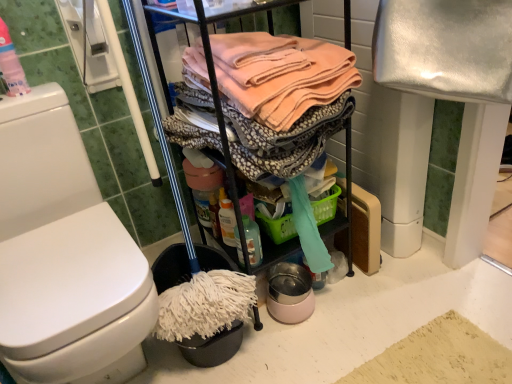
Question: Should I look upward or downward to see translucent plastic spray bottle at lower center, the 2th cleaning products in the left-to-right sequence?

Choices:
 (A) down
 (B) up

Answer: (A)

Question: Is translucent plastic bottle at upper left, which appears as the second cleaning products when viewed from the right, at the back of soft peach fabric at center?

Choices:
 (A) no
 (B) yes

Answer: (A)

Question: Is soft peach fabric at center not close to translucent plastic bottle at upper left, the first cleaning products from the left?

Choices:
 (A) yes
 (B) no

Answer: (B)

Question: Is soft peach fabric at center outside of translucent plastic bottle at upper left, the 1th cleaning products positioned from the top?

Choices:
 (A) no
 (B) yes

Answer: (B)

Question: Considering the relative sizes of soft peach fabric at center and translucent plastic bottle at upper left, which is the 2th cleaning products in bottom-to-top order, in the image provided, is soft peach fabric at center shorter than translucent plastic bottle at upper left, which is the 2th cleaning products in bottom-to-top order,?

Choices:
 (A) no
 (B) yes

Answer: (A)

Question: From a real-world perspective, is soft peach fabric at center physically above translucent plastic bottle at upper left, the 1th cleaning products positioned from the top?

Choices:
 (A) no
 (B) yes

Answer: (A)

Question: From a real-world perspective, does soft peach fabric at center sit lower than translucent plastic bottle at upper left, which appears as the second cleaning products when viewed from the right?

Choices:
 (A) no
 (B) yes

Answer: (B)

Question: From the image's perspective, is translucent plastic spray bottle at lower center, which is counted as the 1th cleaning products, starting from the back, on translucent plastic bottle at upper left, which is the 2th cleaning products in bottom-to-top order?

Choices:
 (A) yes
 (B) no

Answer: (B)

Question: Does translucent plastic spray bottle at lower center, which ranks as the second cleaning products in front-to-back order, appear on the left side of translucent plastic bottle at upper left, the 1th cleaning products positioned from the top?

Choices:
 (A) yes
 (B) no

Answer: (B)

Question: From the image's perspective, is translucent plastic spray bottle at lower center, which ranks as the second cleaning products in front-to-back order, below translucent plastic bottle at upper left, the 1th cleaning products positioned from the top?

Choices:
 (A) yes
 (B) no

Answer: (A)

Question: Does translucent plastic spray bottle at lower center, the first cleaning products positioned from the bottom, have a larger size compared to translucent plastic bottle at upper left, the 1th cleaning products in the front-to-back sequence?

Choices:
 (A) no
 (B) yes

Answer: (A)

Question: Is translucent plastic spray bottle at lower center, which appears as the 2th cleaning products when viewed from the top, aimed at translucent plastic bottle at upper left, which appears as the second cleaning products when viewed from the right?

Choices:
 (A) yes
 (B) no

Answer: (B)

Question: Does translucent plastic spray bottle at lower center, the 2th cleaning products in the left-to-right sequence, have a lesser height compared to translucent plastic bottle at upper left, the 1th cleaning products in the front-to-back sequence?

Choices:
 (A) no
 (B) yes

Answer: (B)

Question: Is translucent plastic bottle at upper left, which is the 2th cleaning products in bottom-to-top order, positioned beyond the bounds of white glossy toilet at left?

Choices:
 (A) yes
 (B) no

Answer: (A)